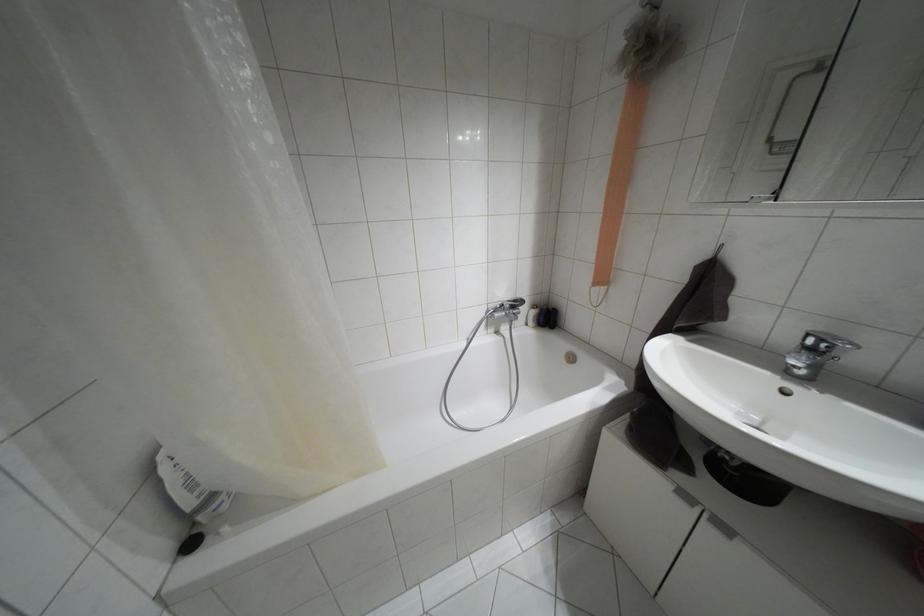
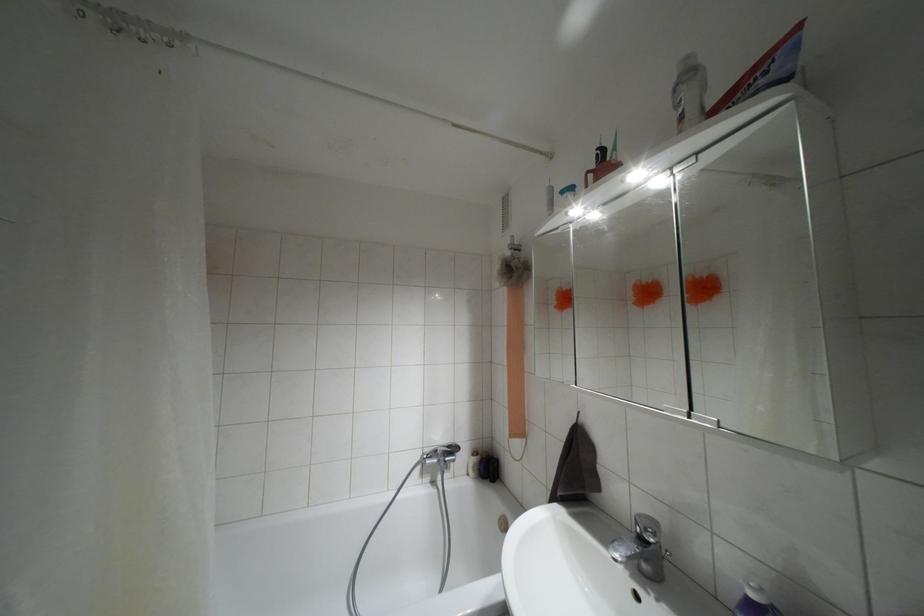
Find the pixel in the second image that matches [514,301] in the first image.

(447, 446)